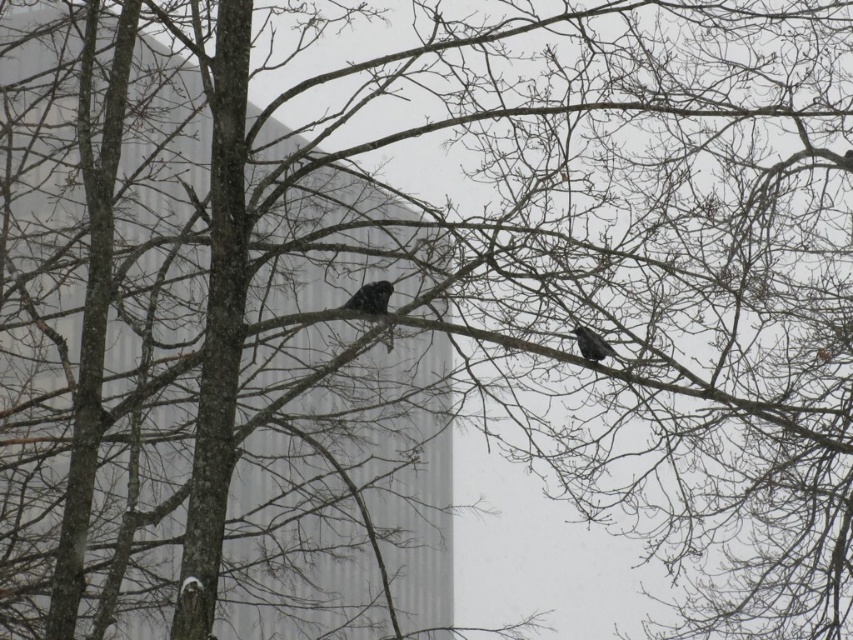
Question: Among these objects, which one is farthest from the camera?

Choices:
 (A) black matte bird at center right
 (B) spotted black bird at center

Answer: (B)

Question: Among these objects, which one is farthest from the camera?

Choices:
 (A) black matte bird at center right
 (B) spotted black bird at center

Answer: (B)

Question: Observing the image, what is the correct spatial positioning of spotted black bird at center in reference to black matte bird at center right?

Choices:
 (A) above
 (B) below

Answer: (A)

Question: Where is spotted black bird at center located in relation to black matte bird at center right in the image?

Choices:
 (A) above
 (B) below

Answer: (A)

Question: Where is spotted black bird at center located in relation to black matte bird at center right in the image?

Choices:
 (A) above
 (B) below

Answer: (A)

Question: Which point is farther to the camera?

Choices:
 (A) (575, 336)
 (B) (354, 300)

Answer: (A)